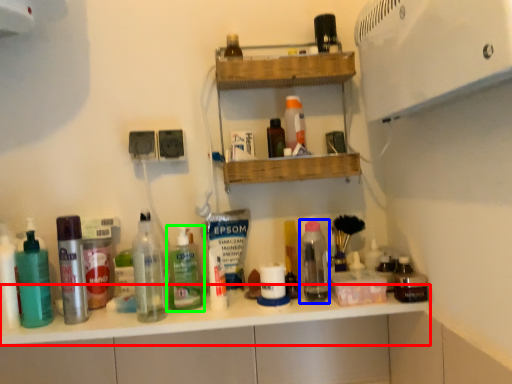
Question: Based on their relative distances, which object is nearer to counter top (highlighted by a red box)? Choose from bottle (highlighted by a blue box) and bottle (highlighted by a green box).

Choices:
 (A) bottle
 (B) bottle

Answer: (B)